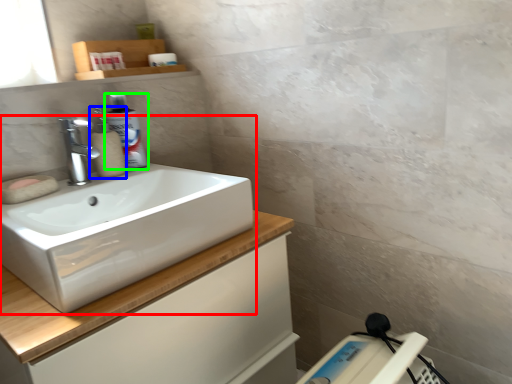
Question: Which object is positioned closest to sink (highlighted by a red box)? Select from soap dispenser (highlighted by a blue box) and cleaning product (highlighted by a green box).

Choices:
 (A) soap dispenser
 (B) cleaning product

Answer: (A)